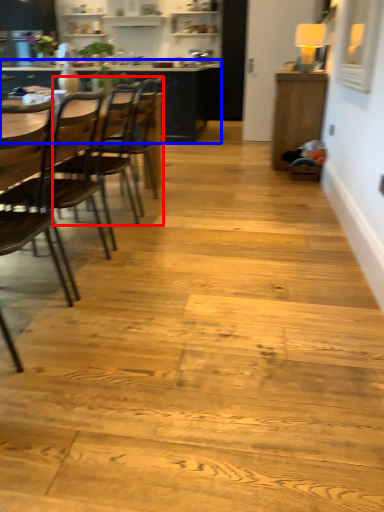
Question: Which point is closer to the camera, chair (highlighted by a red box) or table (highlighted by a blue box)?

Choices:
 (A) chair
 (B) table

Answer: (A)